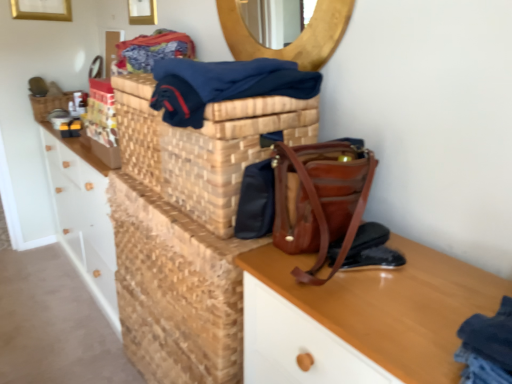
Image resolution: width=512 pixels, height=384 pixels. Find the location of `empty space that is ontop of wooden desk at lower right (from a real-world perspective)`. empty space that is ontop of wooden desk at lower right (from a real-world perspective) is located at coordinates (381, 286).